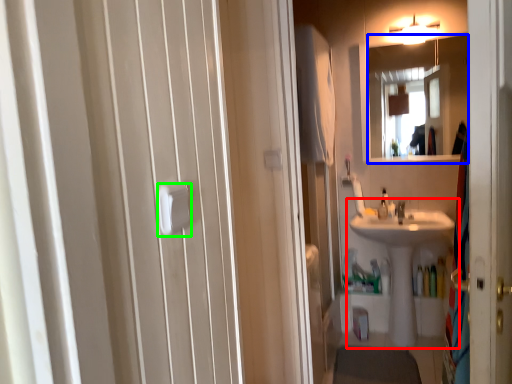
Question: Based on their relative distances, which object is farther from sink (highlighted by a red box)? Choose from mirror (highlighted by a blue box) and towel bar (highlighted by a green box).

Choices:
 (A) mirror
 (B) towel bar

Answer: (B)